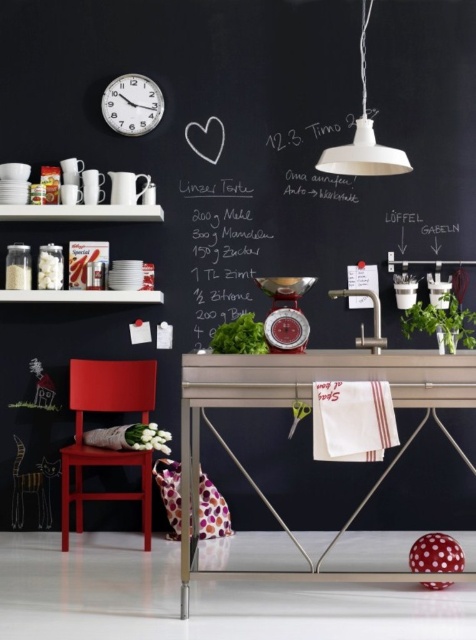
Question: Which object is closer to the camera taking this photo?

Choices:
 (A) green leafy vegetable at center
 (B) green matte plant at right
 (C) metallic silver table at center
 (D) white glossy shelves at upper left

Answer: (C)

Question: From the image, what is the correct spatial relationship of metallic silver table at center in relation to white metallic clock at upper left?

Choices:
 (A) above
 (B) below

Answer: (B)

Question: Which point is closer to the camera?

Choices:
 (A) pyautogui.click(x=379, y=154)
 (B) pyautogui.click(x=90, y=381)
 (C) pyautogui.click(x=469, y=380)
 (D) pyautogui.click(x=50, y=220)

Answer: (C)

Question: Is metallic silver table at center to the right of green leafy vegetable at center from the viewer's perspective?

Choices:
 (A) yes
 (B) no

Answer: (A)

Question: Can you confirm if white chalkboard at center is positioned below green leafy vegetable at center?

Choices:
 (A) yes
 (B) no

Answer: (B)

Question: Which point is closer to the camera?

Choices:
 (A) white matte flowers at lower left
 (B) metallic silver table at center
 (C) white matte pendant light at upper right
 (D) white chalkboard at center

Answer: (B)